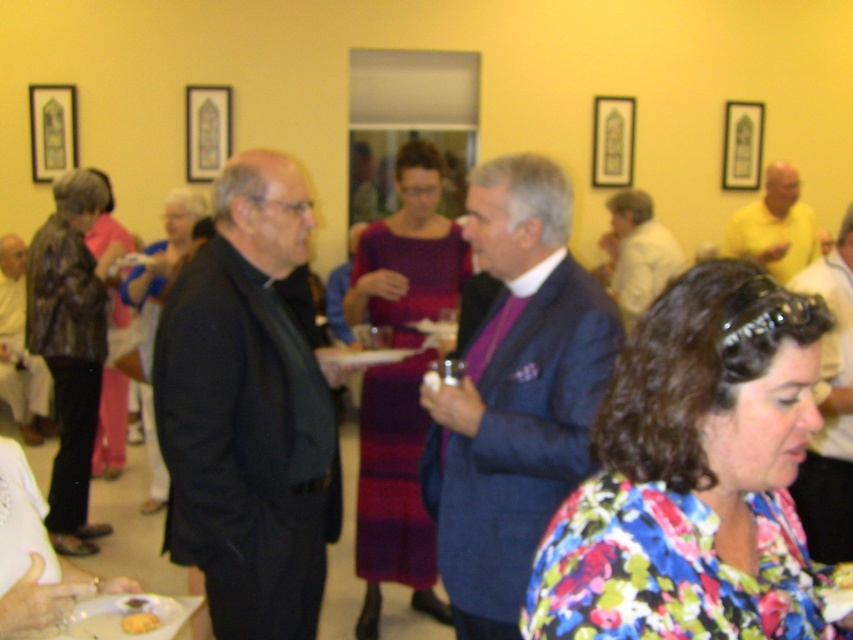
Question: Considering the relative positions of matte black dress at left and white plastic plate at lower left in the image provided, where is matte black dress at left located with respect to white plastic plate at lower left?

Choices:
 (A) left
 (B) right

Answer: (A)

Question: In this image, where is matte purple dress at center located relative to leather jacket at left?

Choices:
 (A) left
 (B) right

Answer: (B)

Question: Which object is positioned farthest from the black leather suit at center?

Choices:
 (A) yellow cotton shirt at right
 (B) white plastic plate at lower left
 (C) matte purple dress at center

Answer: (A)

Question: Is blue wool suit at center smaller than pink fabric dress at left?

Choices:
 (A) yes
 (B) no

Answer: (B)

Question: Which object is positioned farthest from the black leather suit at center?

Choices:
 (A) matte black suit at left
 (B) floral fabric blouse at lower right

Answer: (A)

Question: Which of the following is the farthest from the observer?

Choices:
 (A) (120, 240)
 (B) (3, 273)

Answer: (B)